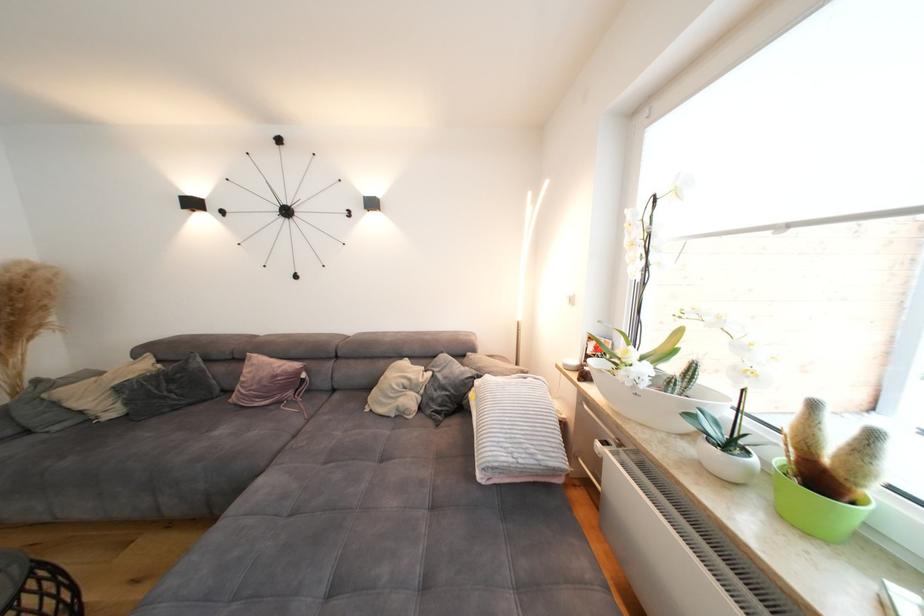
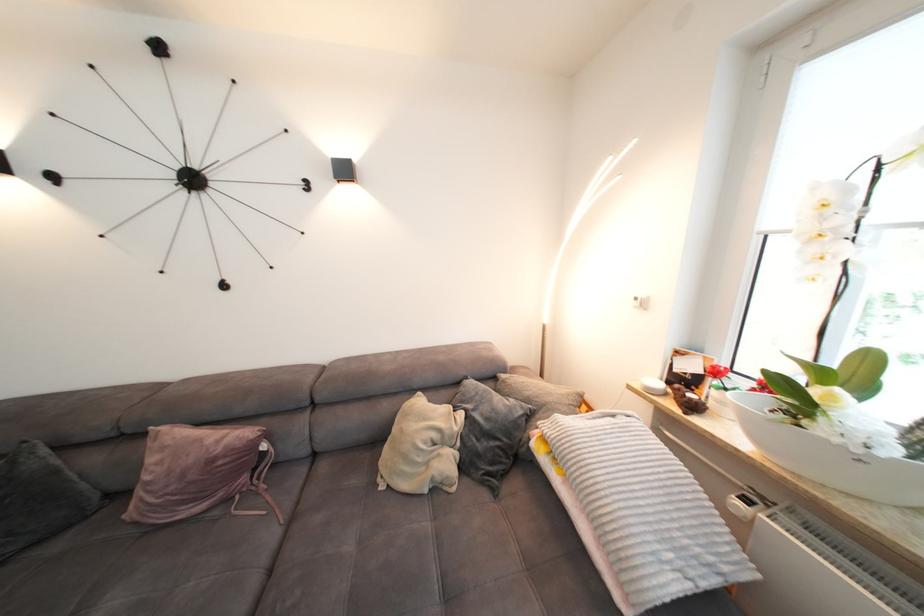
In the second image, find the point that corresponds to (604,446) in the first image.

(746, 505)